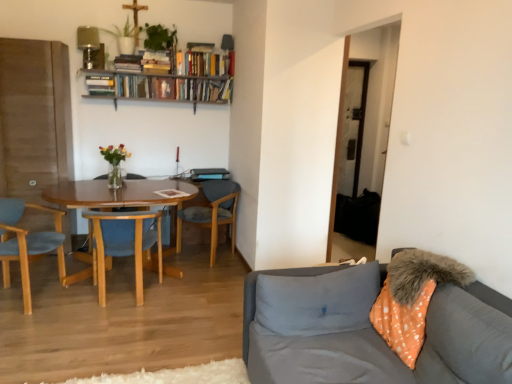
Question: Does wooden chair at center, placed as the third chair when sorted from left to right, turn towards woodenchair at left, which ranks as the second chair in right-to-left order?

Choices:
 (A) no
 (B) yes

Answer: (B)

Question: Is wooden chair at center, placed as the third chair when sorted from left to right, located outside woodenchair at left, which ranks as the second chair in right-to-left order?

Choices:
 (A) yes
 (B) no

Answer: (A)

Question: From the image's perspective, would you say wooden chair at center, placed as the third chair when sorted from left to right, is shown under woodenchair at left, which appears as the 2th chair when viewed from the left?

Choices:
 (A) yes
 (B) no

Answer: (B)

Question: From a real-world perspective, is wooden chair at center, placed as the third chair when sorted from left to right, located higher than woodenchair at left, which ranks as the second chair in right-to-left order?

Choices:
 (A) yes
 (B) no

Answer: (A)

Question: Is wooden chair at center, positioned as the 1th chair in right-to-left order, to the right of woodenchair at left, which appears as the 2th chair when viewed from the left, from the viewer's perspective?

Choices:
 (A) no
 (B) yes

Answer: (B)

Question: Does wooden chair at center, positioned as the 1th chair in right-to-left order, have a smaller size compared to woodenchair at left, which appears as the 2th chair when viewed from the left?

Choices:
 (A) yes
 (B) no

Answer: (B)

Question: Can you confirm if light blue fabric chair at left, which appears as the first chair when viewed from the left, is shorter than gray fabric pillow at lower right?

Choices:
 (A) yes
 (B) no

Answer: (B)

Question: Considering the relative sizes of light blue fabric chair at left, positioned as the 3th chair in right-to-left order, and gray fabric pillow at lower right in the image provided, is light blue fabric chair at left, positioned as the 3th chair in right-to-left order, smaller than gray fabric pillow at lower right?

Choices:
 (A) no
 (B) yes

Answer: (A)

Question: From a real-world perspective, is light blue fabric chair at left, positioned as the 3th chair in right-to-left order, physically below gray fabric pillow at lower right?

Choices:
 (A) no
 (B) yes

Answer: (B)

Question: Does light blue fabric chair at left, which appears as the first chair when viewed from the left, contain gray fabric pillow at lower right?

Choices:
 (A) yes
 (B) no

Answer: (B)

Question: Considering the relative sizes of light blue fabric chair at left, positioned as the 3th chair in right-to-left order, and gray fabric pillow at lower right in the image provided, is light blue fabric chair at left, positioned as the 3th chair in right-to-left order, thinner than gray fabric pillow at lower right?

Choices:
 (A) no
 (B) yes

Answer: (A)

Question: Can we say light blue fabric chair at left, positioned as the 3th chair in right-to-left order, lies outside gray fabric pillow at lower right?

Choices:
 (A) no
 (B) yes

Answer: (B)

Question: Is woodenchair at left, which appears as the 2th chair when viewed from the left, placed right next to gray fabric pillow at lower right?

Choices:
 (A) no
 (B) yes

Answer: (A)